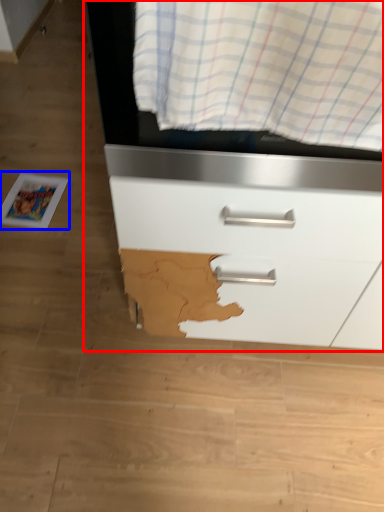
Question: Among these objects, which one is nearest to the camera, chest of drawers (highlighted by a red box) or magazine (highlighted by a blue box)?

Choices:
 (A) chest of drawers
 (B) magazine

Answer: (A)